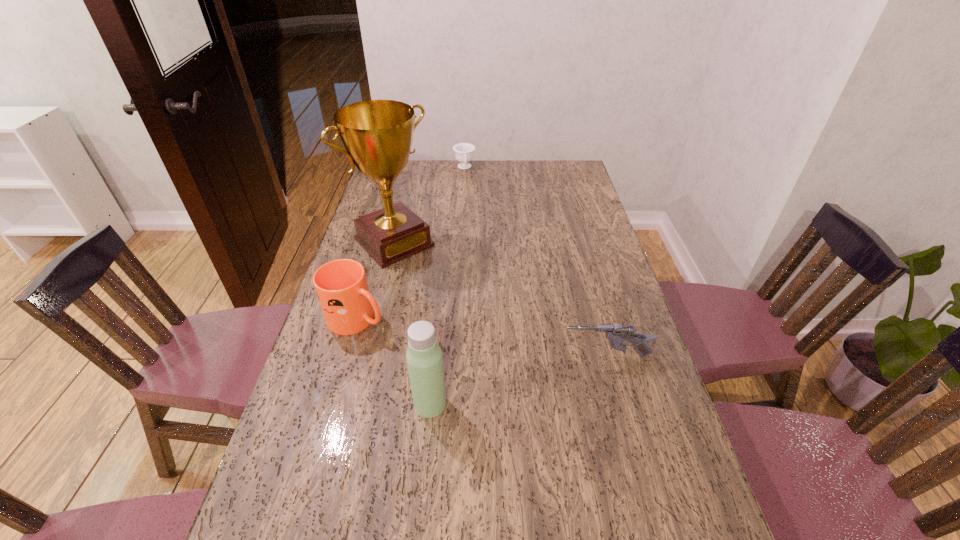
Find the location of a particular element. The height and width of the screenshot is (540, 960). vacant space on the desktop that is between the nearest object and the rightmost object and is positioned on the handle side of the third nearest object is located at coordinates (502, 384).

At what (x,y) coordinates should I click in order to perform the action: click on free spot on the desktop that is between the nearest object and the fourth tallest object and is positioned on the plaque of the second farthest object. Please return your answer as a coordinate pair (x, y). The width and height of the screenshot is (960, 540). Looking at the image, I should click on (531, 377).

Locate an element on the screen. The width and height of the screenshot is (960, 540). free space on the desktop that is between the thermos bottle and the rightmost object and is positioned on the side of the teacup with the handle is located at coordinates (510, 382).